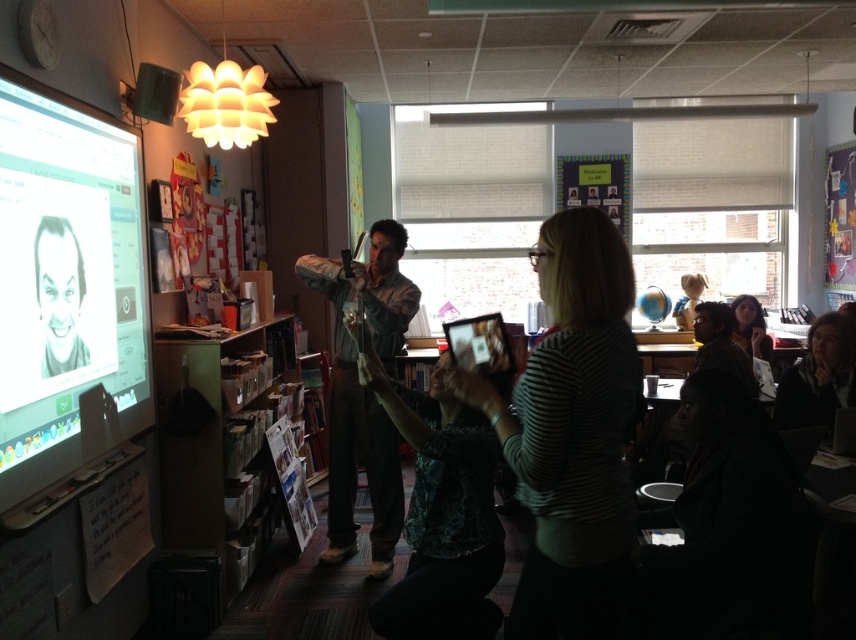
Is striped fabric shirt at center closer to camera compared to matte black hair at upper right?

Yes, striped fabric shirt at center is in front of matte black hair at upper right.

Does striped fabric shirt at center have a larger size compared to matte black hair at upper right?

Indeed, striped fabric shirt at center has a larger size compared to matte black hair at upper right.

The height and width of the screenshot is (640, 856). What are the coordinates of `striped fabric shirt at center` in the screenshot? It's located at (571, 433).

Can you confirm if striped fabric shirt at center is shorter than wooden bookshelf at lower left?

Correct, striped fabric shirt at center is not as tall as wooden bookshelf at lower left.

Who is positioned more to the left, striped fabric shirt at center or wooden bookshelf at lower left?

wooden bookshelf at lower left

Describe the element at coordinates (571, 433) in the screenshot. I see `striped fabric shirt at center` at that location.

Locate an element on the screen. This screenshot has width=856, height=640. striped fabric shirt at center is located at coordinates (571, 433).

Consider the image. Between white glossy screen at left and matte black hair at upper right, which one appears on the left side from the viewer's perspective?

white glossy screen at left

Is point (93, 416) positioned after point (742, 333)?

That is False.

Find the location of a particular element. white glossy screen at left is located at coordinates (67, 284).